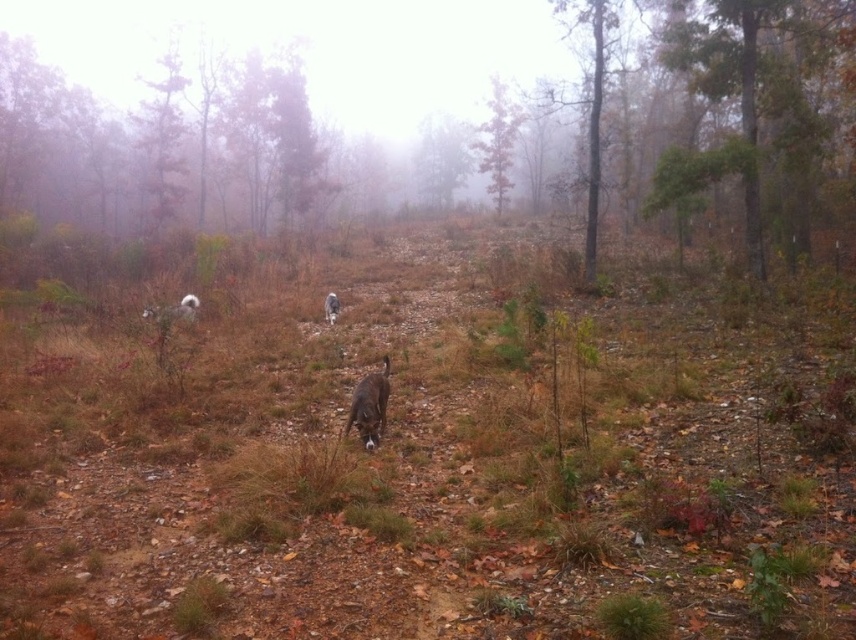
Can you confirm if green matte tree at upper center is taller than green leafy tree at center?

No, green matte tree at upper center is not taller than green leafy tree at center.

Does point (438, 170) come farther from viewer compared to point (504, 115)?

Yes, it is.

Which is behind, point (449, 184) or point (477, 154)?

Point (477, 154)

Locate an element on the screen. green matte tree at upper center is located at coordinates (441, 161).

Between white fluffy dog at left and white fur dog at center, which one is positioned lower?

white fur dog at center

Who is higher up, white fluffy dog at left or white fur dog at center?

white fluffy dog at left is above.

What do you see at coordinates (174, 310) in the screenshot? This screenshot has height=640, width=856. I see `white fluffy dog at left` at bounding box center [174, 310].

You are a GUI agent. You are given a task and a screenshot of the screen. Output one action in this format:
    pyautogui.click(x=<x>, y=<y>)
    Task: Click on the white fluffy dog at left
    The width and height of the screenshot is (856, 640).
    Given the screenshot: What is the action you would take?
    pyautogui.click(x=174, y=310)

Is point (152, 112) in front of point (334, 296)?

No.

Who is positioned more to the right, green matte tree at upper left or white fur dog at center?

Positioned to the right is white fur dog at center.

Where is `green matte tree at upper left`? Image resolution: width=856 pixels, height=640 pixels. green matte tree at upper left is located at coordinates (163, 138).